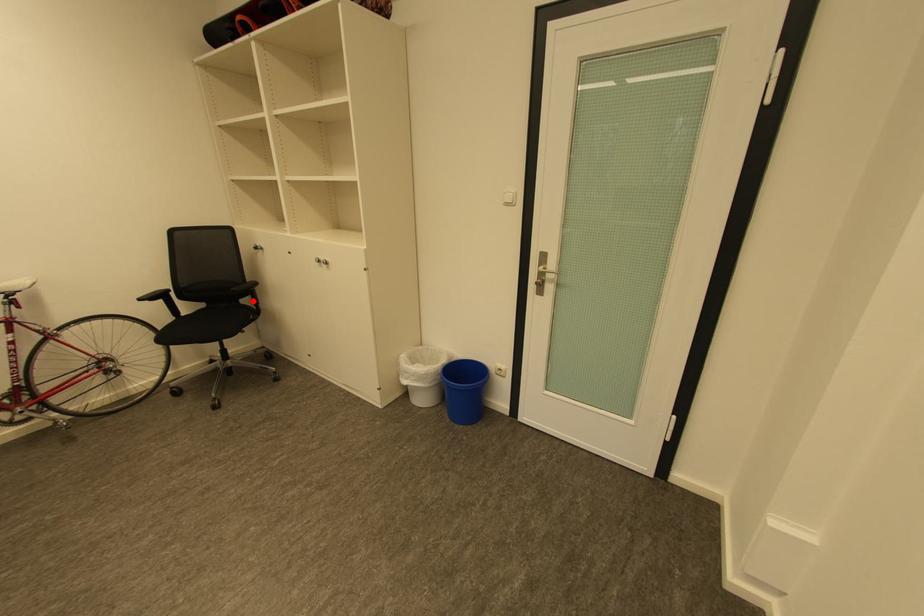
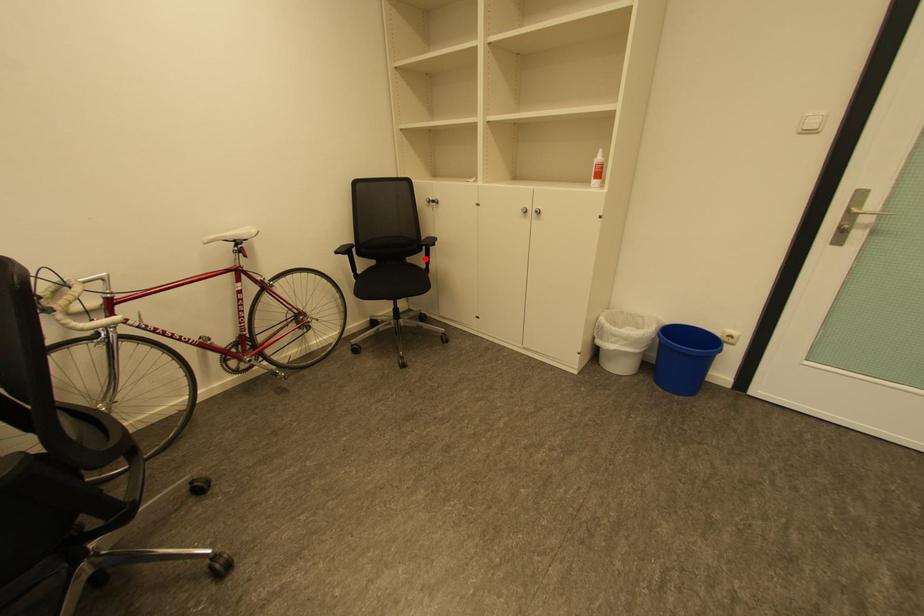
I am providing you with two images of the same scene from different viewpoints. A red point is marked on the first image and another point is marked on the second image. Do the highlighted points in image1 and image2 indicate the same real-world spot?

Yes